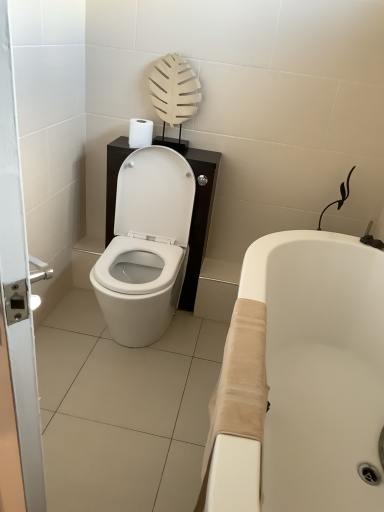
Question: Is beige fabric bathtub at lower right oriented away from white glossy toilet at center?

Choices:
 (A) yes
 (B) no

Answer: (B)

Question: Does beige fabric bathtub at lower right lie in front of white glossy toilet at center?

Choices:
 (A) yes
 (B) no

Answer: (A)

Question: Considering the relative sizes of beige fabric bathtub at lower right and white glossy toilet at center in the image provided, is beige fabric bathtub at lower right thinner than white glossy toilet at center?

Choices:
 (A) no
 (B) yes

Answer: (A)

Question: Is beige fabric bathtub at lower right to the left of white glossy toilet at center from the viewer's perspective?

Choices:
 (A) yes
 (B) no

Answer: (B)

Question: Can you confirm if beige fabric bathtub at lower right is bigger than white glossy toilet at center?

Choices:
 (A) no
 (B) yes

Answer: (B)

Question: In terms of height, does white matte toilet paper at upper center look taller or shorter compared to white glossy toilet at center?

Choices:
 (A) short
 (B) tall

Answer: (A)

Question: Is point (142, 133) closer or farther from the camera than point (192, 182)?

Choices:
 (A) farther
 (B) closer

Answer: (B)

Question: Is white matte toilet paper at upper center bigger or smaller than white glossy toilet at center?

Choices:
 (A) small
 (B) big

Answer: (A)

Question: Looking at their shapes, would you say white matte toilet paper at upper center is wider or thinner than white glossy toilet at center?

Choices:
 (A) thin
 (B) wide

Answer: (A)

Question: Is beige fabric bathtub at lower right to the left or to the right of white glossy toilet at center in the image?

Choices:
 (A) right
 (B) left

Answer: (A)

Question: From the image's perspective, is beige fabric bathtub at lower right above or below white glossy toilet at center?

Choices:
 (A) below
 (B) above

Answer: (A)

Question: From a real-world perspective, relative to white glossy toilet at center, is beige fabric bathtub at lower right vertically above or below?

Choices:
 (A) below
 (B) above

Answer: (A)

Question: Is beige fabric bathtub at lower right inside or outside of white glossy toilet at center?

Choices:
 (A) outside
 (B) inside

Answer: (A)

Question: Would you say beige fabric bathtub at lower right is to the left or to the right of white glossy door at left in the picture?

Choices:
 (A) left
 (B) right

Answer: (B)

Question: Is beige fabric bathtub at lower right in front of or behind white glossy door at left in the image?

Choices:
 (A) front
 (B) behind

Answer: (B)